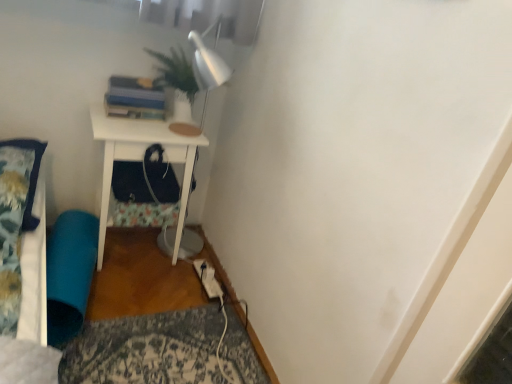
Question: Does teal fabric bean bag at lower left have a larger size compared to fluffy blue pillow at left?

Choices:
 (A) no
 (B) yes

Answer: (B)

Question: From the image's perspective, is teal fabric bean bag at lower left on fluffy blue pillow at left?

Choices:
 (A) yes
 (B) no

Answer: (B)

Question: From the image's perspective, does teal fabric bean bag at lower left appear lower than fluffy blue pillow at left?

Choices:
 (A) no
 (B) yes

Answer: (B)

Question: Can you confirm if teal fabric bean bag at lower left is shorter than fluffy blue pillow at left?

Choices:
 (A) no
 (B) yes

Answer: (A)

Question: Can you confirm if teal fabric bean bag at lower left is smaller than fluffy blue pillow at left?

Choices:
 (A) yes
 (B) no

Answer: (B)

Question: Is teal fabric bean bag at lower left facing away from fluffy blue pillow at left?

Choices:
 (A) no
 (B) yes

Answer: (A)

Question: Considering the relative sizes of fluffy blue pillow at left and white matte nightstand at center in the image provided, is fluffy blue pillow at left bigger than white matte nightstand at center?

Choices:
 (A) yes
 (B) no

Answer: (B)

Question: Is fluffy blue pillow at left smaller than white matte nightstand at center?

Choices:
 (A) yes
 (B) no

Answer: (A)

Question: Considering the relative positions of fluffy blue pillow at left and white matte nightstand at center in the image provided, is fluffy blue pillow at left to the left of white matte nightstand at center from the viewer's perspective?

Choices:
 (A) no
 (B) yes

Answer: (B)

Question: Considering the relative positions of fluffy blue pillow at left and white matte nightstand at center in the image provided, is fluffy blue pillow at left in front of white matte nightstand at center?

Choices:
 (A) no
 (B) yes

Answer: (B)

Question: From a real-world perspective, is fluffy blue pillow at left over white matte nightstand at center?

Choices:
 (A) no
 (B) yes

Answer: (B)

Question: Is fluffy blue pillow at left directly adjacent to white matte nightstand at center?

Choices:
 (A) yes
 (B) no

Answer: (B)

Question: Is white matte nightstand at center directly adjacent to teal fabric bean bag at lower left?

Choices:
 (A) yes
 (B) no

Answer: (B)